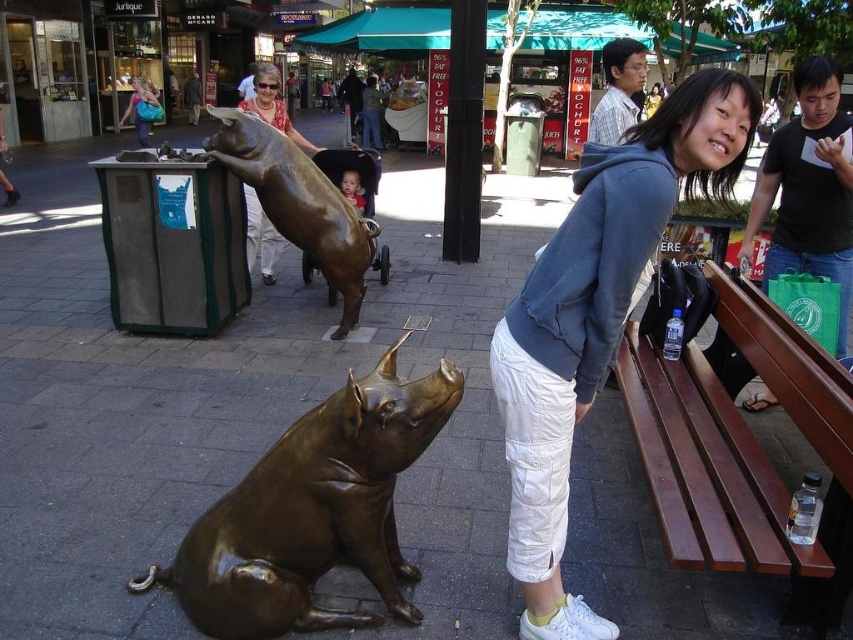
Question: Which point is farther to the camera?

Choices:
 (A) (140, 80)
 (B) (235, 620)
 (C) (251, 208)

Answer: (A)

Question: Does blue hoodie at center have a greater width compared to brushed metal pig at upper center?

Choices:
 (A) yes
 (B) no

Answer: (B)

Question: Estimate the real-world distances between objects in this image. Which object is closer to the brown wood bench at right?

Choices:
 (A) bronze statue at lower left
 (B) brushed metal pig at upper center
 (C) black matte bag at upper right

Answer: (C)

Question: Does bronze statue at lower left appear over matte bronze pig at upper center?

Choices:
 (A) no
 (B) yes

Answer: (A)

Question: Is bronze statue at lower left behind bronze statue at center?

Choices:
 (A) yes
 (B) no

Answer: (B)

Question: Which point is farther to the camera?

Choices:
 (A) (688, 552)
 (B) (270, 209)
 (C) (561, 349)
 (D) (142, 106)

Answer: (D)